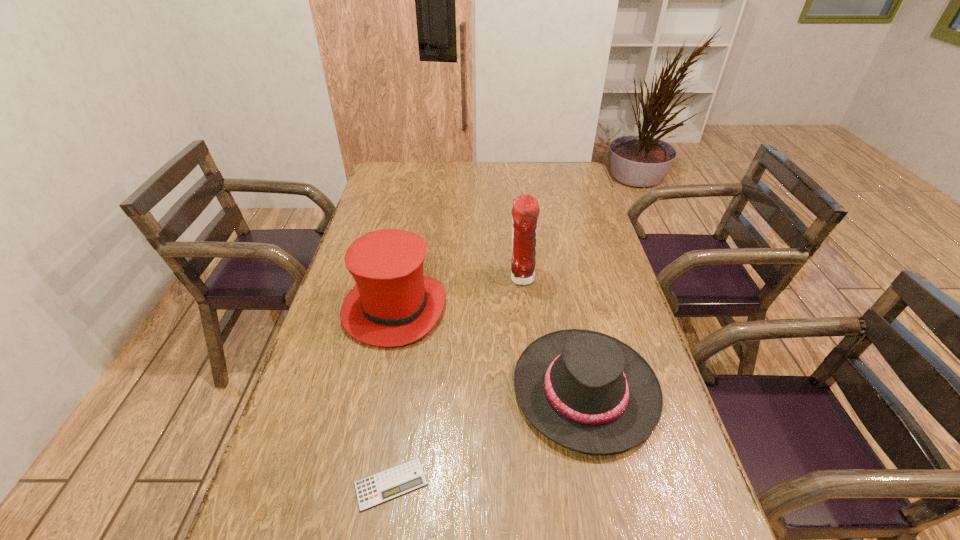
The height and width of the screenshot is (540, 960). In order to click on free spot between the calculator and the third shortest object in this screenshot , I will do `click(393, 396)`.

You are a GUI agent. You are given a task and a screenshot of the screen. Output one action in this format:
    pyautogui.click(x=<x>, y=<y>)
    Task: Click on the unoccupied area between the shortest object and the condiment
    This screenshot has width=960, height=540.
    Given the screenshot: What is the action you would take?
    pyautogui.click(x=456, y=381)

You are a GUI agent. You are given a task and a screenshot of the screen. Output one action in this format:
    pyautogui.click(x=<x>, y=<y>)
    Task: Click on the empty space between the third shortest object and the shortest object
    This screenshot has width=960, height=540.
    Given the screenshot: What is the action you would take?
    pyautogui.click(x=393, y=396)

The image size is (960, 540). Find the location of `free space between the right dress hat and the left dress hat`. free space between the right dress hat and the left dress hat is located at coordinates (490, 349).

The height and width of the screenshot is (540, 960). What are the coordinates of `object that is the third closest to the right dress hat` in the screenshot? It's located at tap(384, 486).

Where is `object that is the third nearest to the taller dress hat`? object that is the third nearest to the taller dress hat is located at coordinates (384, 486).

What are the coordinates of `free space in the image that satisfies the following two spatial constraints: 1. on the front side of the condiment; 2. on the right side of the third tallest object` in the screenshot? It's located at (533, 390).